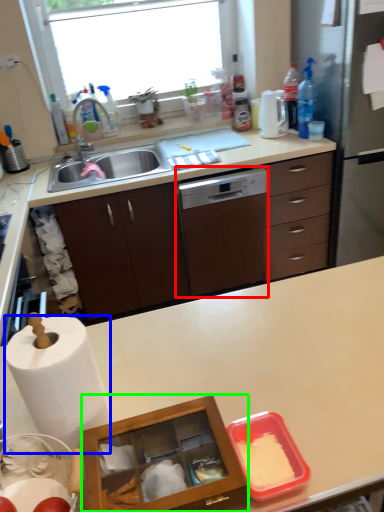
Question: Which object is positioned closest to home appliance (highlighted by a red box)? Select from paper towel (highlighted by a blue box) and crate (highlighted by a green box).

Choices:
 (A) paper towel
 (B) crate

Answer: (A)